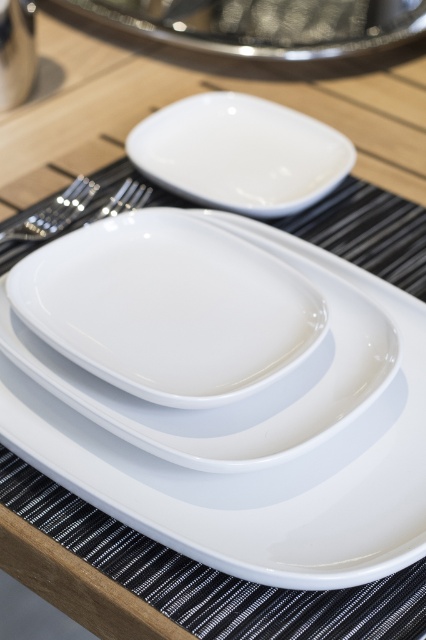
Question: Can you confirm if glossy ceramic plate at center is positioned to the right of white glossy platter at center?

Choices:
 (A) no
 (B) yes

Answer: (B)

Question: Observing the image, what is the correct spatial positioning of white glossy platter at upper center in reference to satin silver fork at left?

Choices:
 (A) right
 (B) left

Answer: (A)

Question: Does glossy ceramic plate at center have a greater width compared to white glossy platter at center?

Choices:
 (A) yes
 (B) no

Answer: (A)

Question: Which point is farther to the camera?

Choices:
 (A) (245, 122)
 (B) (42, 228)
 (C) (368, 285)

Answer: (A)

Question: Among these points, which one is farthest from the camera?

Choices:
 (A) click(x=299, y=3)
 (B) click(x=8, y=237)

Answer: (A)

Question: Which point is farther to the camera?

Choices:
 (A) (253, 154)
 (B) (57, 202)

Answer: (A)